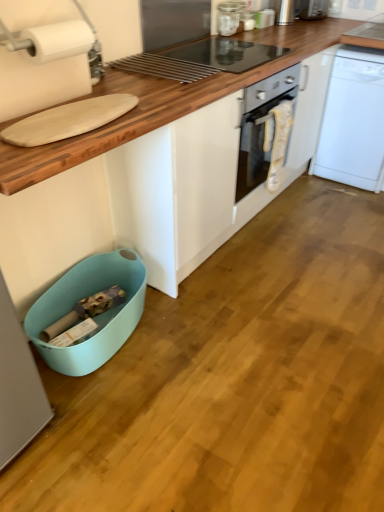
Question: Is metallic silver toaster at upper center, arranged as the third appliance when ordered from the bottom, to the left or to the right of white matte paper towel at upper left in the image?

Choices:
 (A) right
 (B) left

Answer: (A)

Question: From their relative heights in the image, would you say metallic silver toaster at upper center, the 3th appliance when ordered from left to right, is taller or shorter than white matte paper towel at upper left?

Choices:
 (A) short
 (B) tall

Answer: (A)

Question: Based on their relative distances, which object is nearer to the white plastic dishwasher at right?

Choices:
 (A) wooden cutting board at upper left
 (B) white matte paper towel at upper left
 (C) satin silver toaster at upper right, the fifth appliance from the front
 (D) clear glass jar at upper center, the second appliance from the front
 (E) teal plastic dish washer at lower left

Answer: (A)

Question: Considering the real-world distances, which object is closest to the satin silver toaster at upper right, the fifth appliance from the front?

Choices:
 (A) wooden cutting board at upper left
 (B) metallic silver toaster at upper center, positioned as the third appliance in right-to-left order
 (C) teal plastic dish washer at lower left
 (D) white matte paper towel at upper left
 (E) metallic silver toaster at upper center, which is the 5th appliance in back-to-front order

Answer: (B)